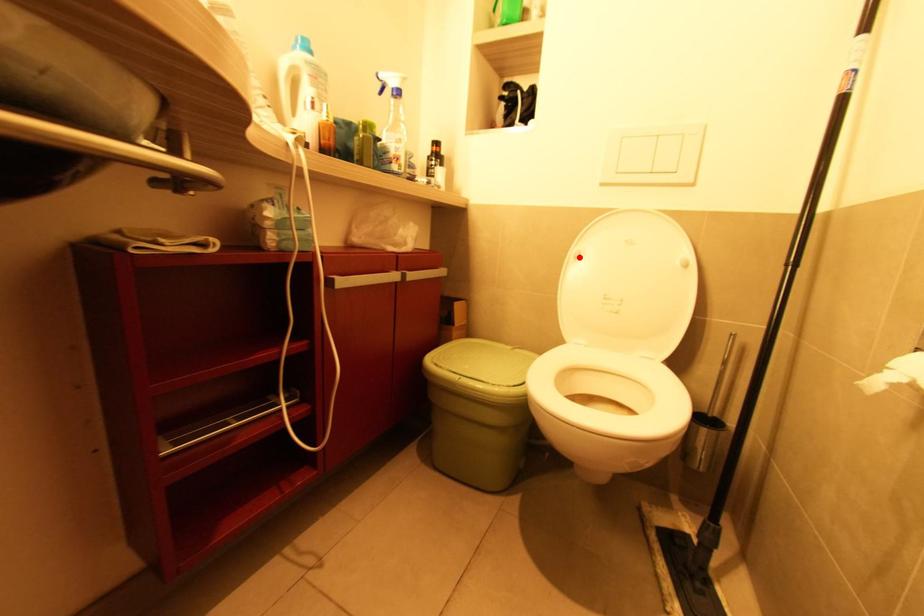
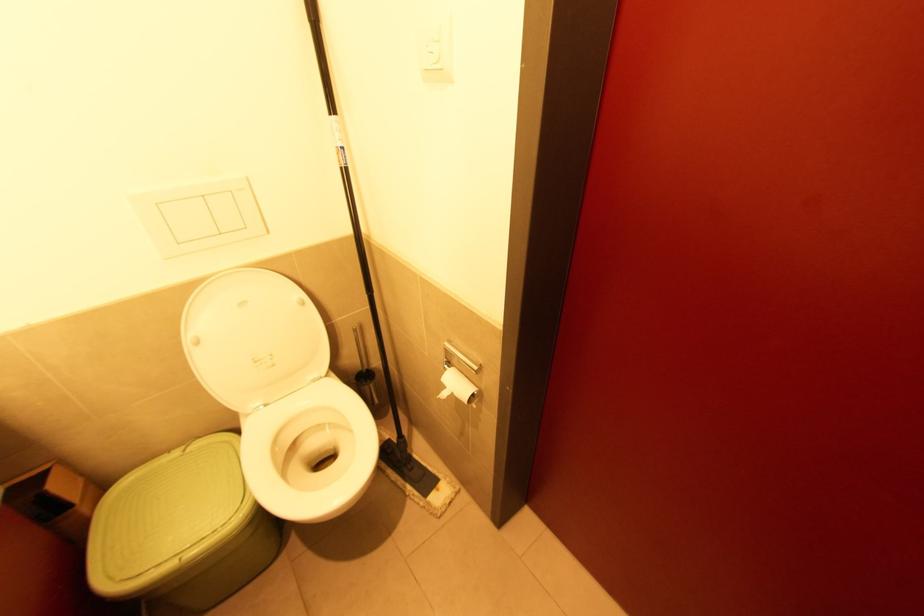
Locate, in the second image, the point that corresponds to the highlighted location in the first image.

(200, 342)